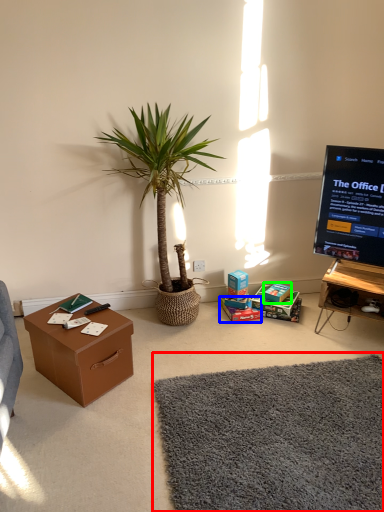
Question: Which is farther away from plain (highlighted by a red box)? storage box (highlighted by a blue box) or storage box (highlighted by a green box)?

Choices:
 (A) storage box
 (B) storage box

Answer: (B)